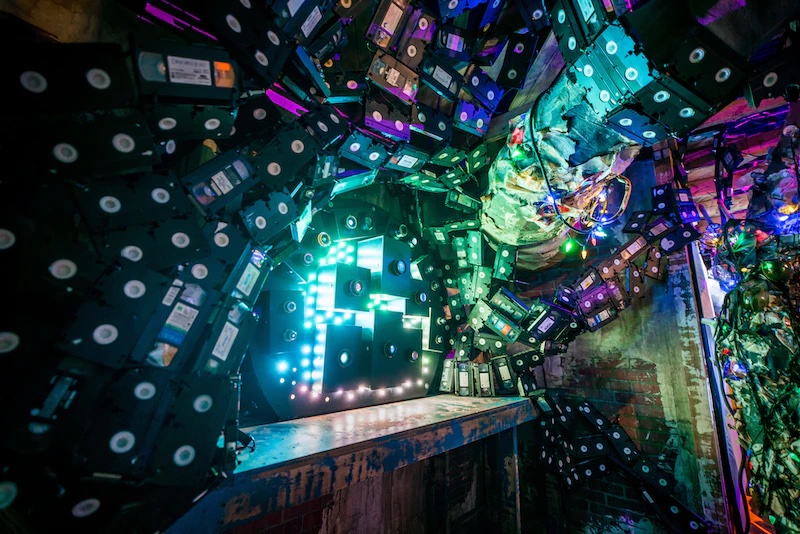
You are a GUI agent. You are given a task and a screenshot of the screen. Output one action in this format:
    pyautogui.click(x=<x>, y=<y>)
    Task: Click on the wood beam with white paint
    
    Given the screenshot: What is the action you would take?
    pyautogui.click(x=694, y=345)